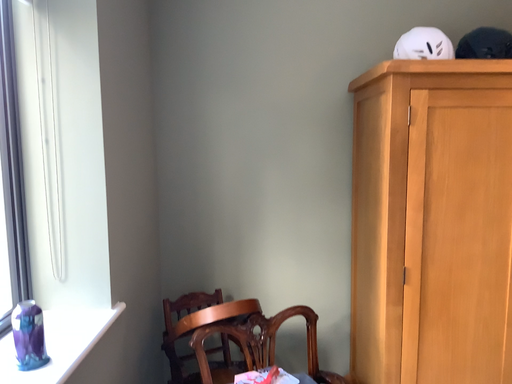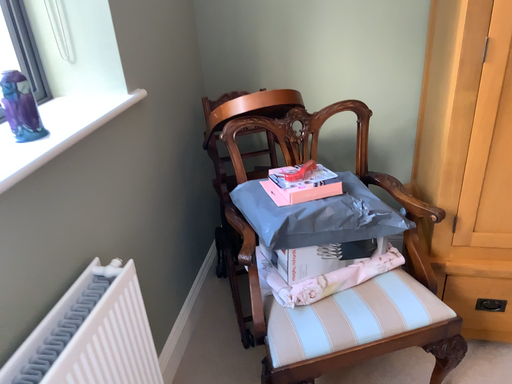
Question: How did the camera likely rotate when shooting the video?

Choices:
 (A) rotated downward
 (B) rotated upward

Answer: (A)